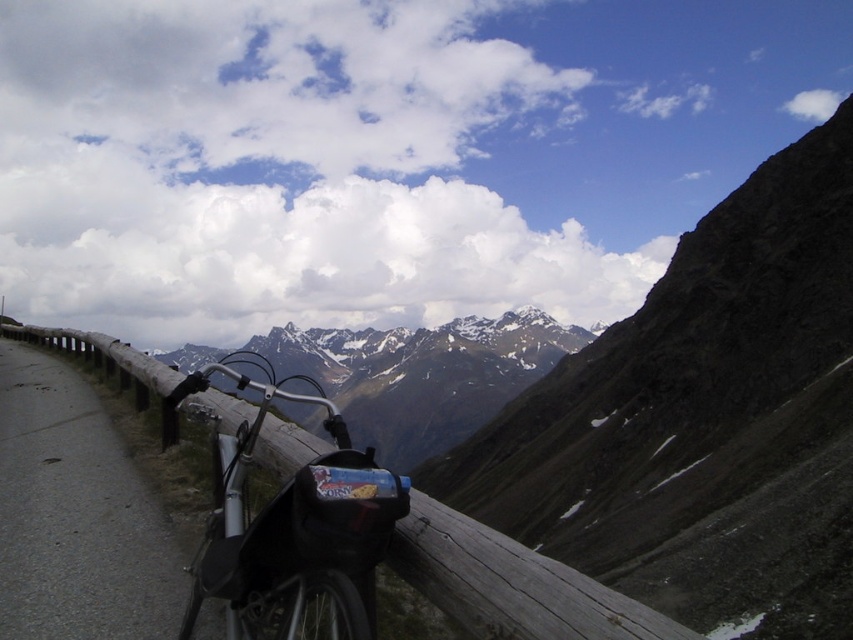
You are a hiker planning to take a photo of the snowy rocky mountain range at center and the wooden at left. Which object should you focus on first if you want to capture both in a single frame without moving the camera?

The snowy rocky mountain range at center is larger in size than wooden at left, so you should focus on the snowy rocky mountain range at center first to ensure it fills the frame appropriately before adjusting for the smaller wooden at left.

You are a hiker planning to walk along the paved road. You see the shiny metallic bicycle at center and the wooden at left. Which object is closer to you?

The shiny metallic bicycle at center is closer to you because it is further to the viewer than the wooden at left.

You are a hiker who wants to know if the shiny metallic bicycle at center can fit through a narrow gap between two trees that is the same height as the wooden at left. Can it?

The shiny metallic bicycle at center is not as tall as the wooden at left, so it can fit through the gap since the gap is the same height as the wooden object.